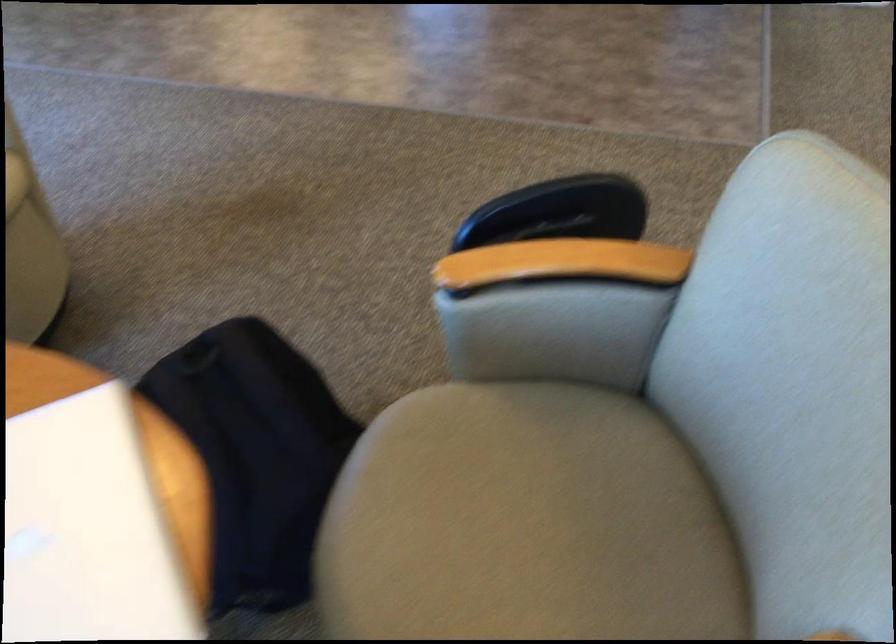
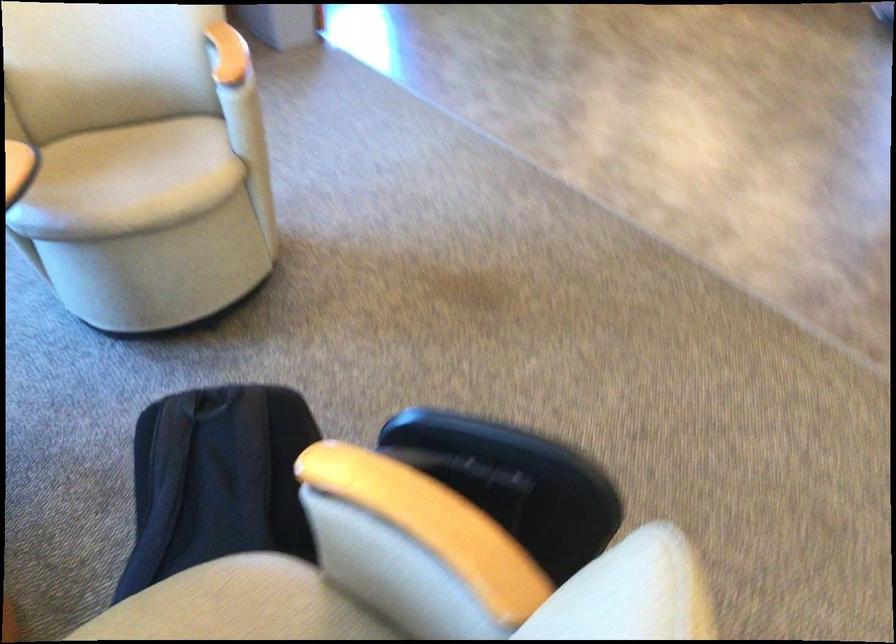
Question: How did the camera likely rotate?

Choices:
 (A) Left
 (B) Right
 (C) Up
 (D) Down

Answer: (A)